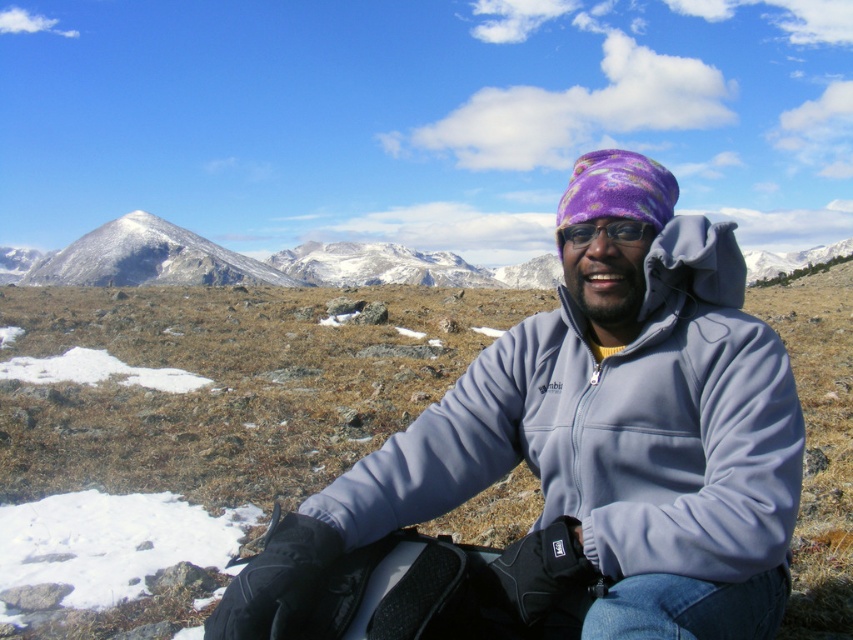
Question: Which object is the farthest from the snowy rock mountain at left?

Choices:
 (A) purple fleece goggles at center
 (B) gray fleece jacket at center

Answer: (A)

Question: Does gray fleece jacket at center have a greater width compared to snowy rock mountain at left?

Choices:
 (A) yes
 (B) no

Answer: (B)

Question: Is snowy rock mountain at left to the right of purple fleece goggles at center from the viewer's perspective?

Choices:
 (A) no
 (B) yes

Answer: (A)

Question: Considering the real-world distances, which object is farthest from the gray fleece jacket at center?

Choices:
 (A) purple fleece goggles at center
 (B) snowy rock mountain at left

Answer: (B)

Question: Is gray fleece jacket at center above snowy rock mountain at left?

Choices:
 (A) yes
 (B) no

Answer: (B)

Question: Among these points, which one is farthest from the camera?

Choices:
 (A) (630, 227)
 (B) (706, 397)

Answer: (A)